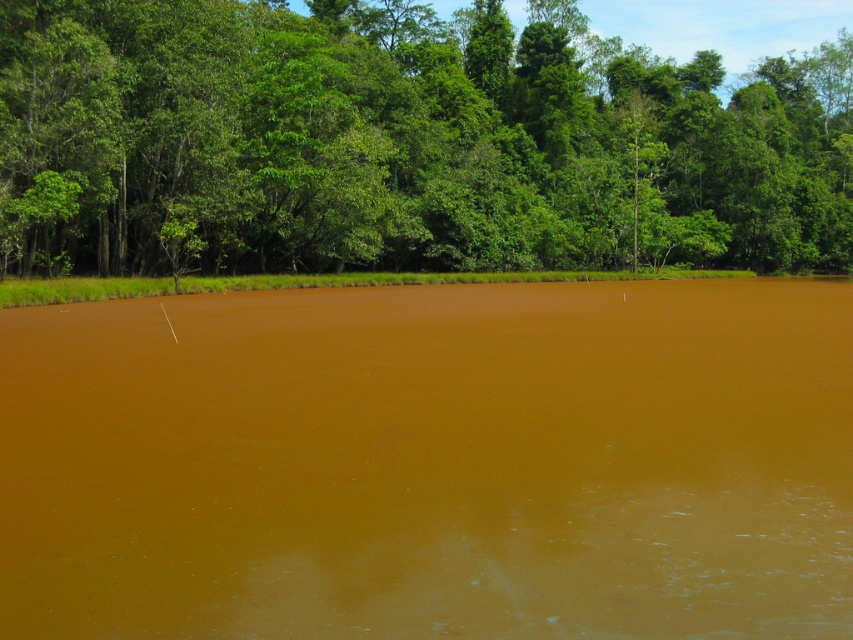
What do you see at coordinates (431, 464) in the screenshot? This screenshot has height=640, width=853. I see `brown matte lake at center` at bounding box center [431, 464].

Is point (563, 371) more distant than point (570, 104)?

No.

Where is `brown matte lake at center`? This screenshot has height=640, width=853. brown matte lake at center is located at coordinates (431, 464).